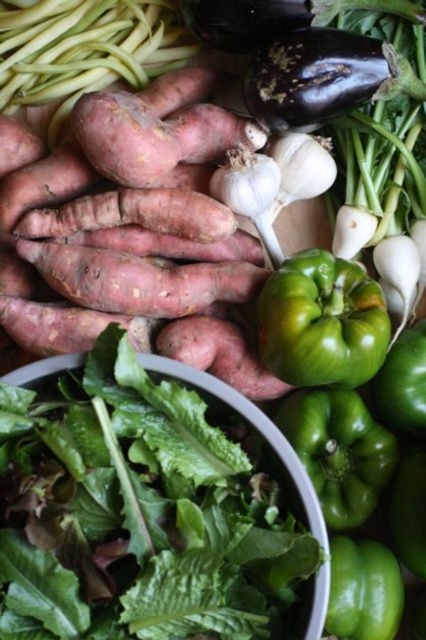
Does point (120, 214) come in front of point (344, 369)?

That is False.

Who is lower down, rustic brown sweet potato at center or green matte bell pepper at center?

green matte bell pepper at center is below.

Between point (124, 291) and point (310, 356), which one is positioned in front?

Point (310, 356)

Locate an element on the screen. This screenshot has height=640, width=426. rustic brown sweet potato at center is located at coordinates (138, 230).